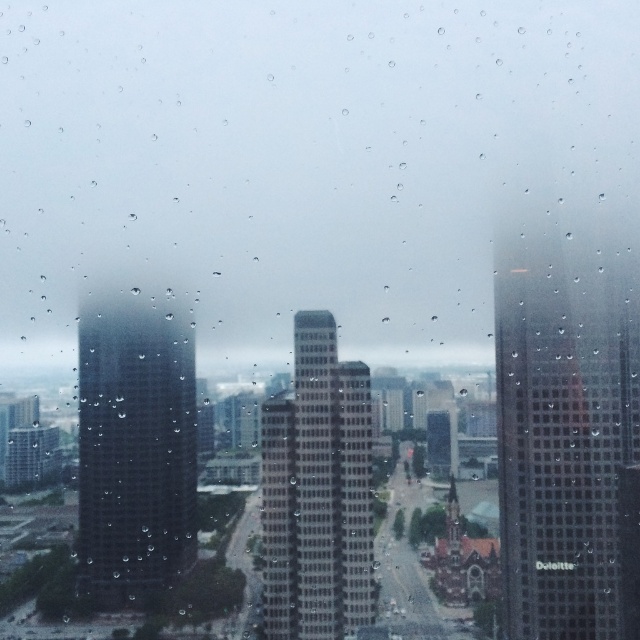
You are standing in a room and looking through the window at the city outside. You see the matte glass skyscraper at right and the gray concrete skyscraper at center. Which of these two skyscrapers is closer to you based on their positions in the scene?

The matte glass skyscraper at right is positioned over the gray concrete skyscraper at center, which means it is closer to you.

You are a window cleaner who needs to clean the tallest skyscraper in the scene. Which one should you choose between the matte glass skyscraper at right and the gray concrete skyscraper at center?

The matte glass skyscraper at right is taller than the gray concrete skyscraper at center, so you should choose the matte glass skyscraper at right to clean.